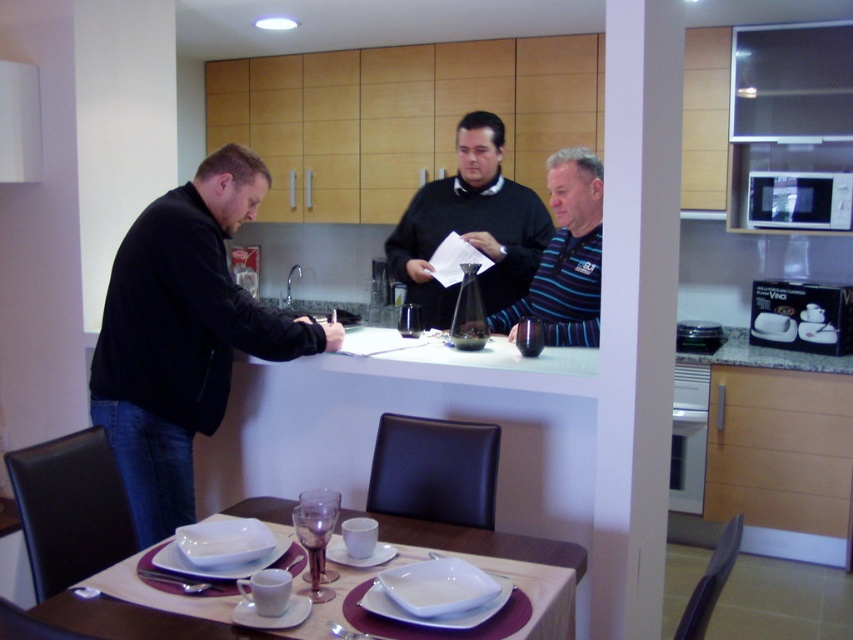
You are organizing a kitchen event and need to place a decorative item on the dining table. The black matte jacket at left and the metallic silver microwave at upper right are available. Which object would you choose to place on the table if you want something that is larger?

The black matte jacket at left has a larger size compared to the metallic silver microwave at upper right, so you should choose the black matte jacket at left to place on the table.